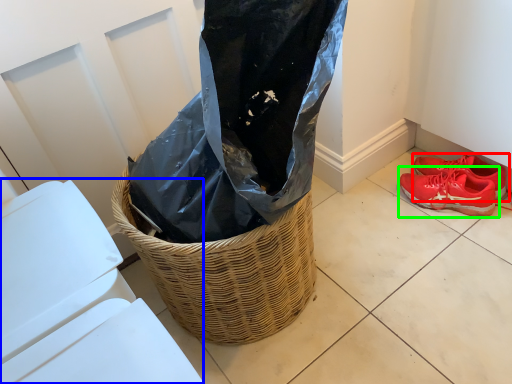
Question: Considering the real-world distances, which object is farthest from footwear (highlighted by a red box)? lift (highlighted by a blue box) or footwear (highlighted by a green box)?

Choices:
 (A) lift
 (B) footwear

Answer: (A)